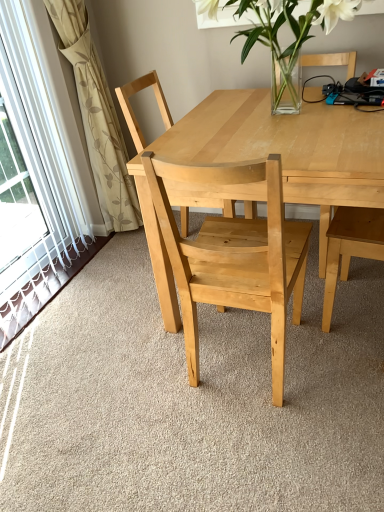
Question: In which direction should I rotate to look at natural wood chair at center, which is counted as the second chair, starting from the front?

Choices:
 (A) left
 (B) right

Answer: (B)

Question: From a real-world perspective, is natural wood chair at center, placed as the first chair when sorted from back to front, physically above beige floral fabric at left?

Choices:
 (A) yes
 (B) no

Answer: (B)

Question: Is beige floral fabric at left at the back of natural wood chair at center, which is counted as the second chair, starting from the front?

Choices:
 (A) no
 (B) yes

Answer: (B)

Question: Can we say natural wood chair at center, which is counted as the second chair, starting from the front, lies outside beige floral fabric at left?

Choices:
 (A) yes
 (B) no

Answer: (A)

Question: From a real-world perspective, is natural wood chair at center, which is counted as the second chair, starting from the front, under beige floral fabric at left?

Choices:
 (A) yes
 (B) no

Answer: (A)

Question: Could you tell me if natural wood chair at center, placed as the first chair when sorted from back to front, is turned towards beige floral fabric at left?

Choices:
 (A) no
 (B) yes

Answer: (A)

Question: Considering the relative sizes of natural wood chair at center, which is counted as the second chair, starting from the front, and beige floral fabric at left in the image provided, is natural wood chair at center, which is counted as the second chair, starting from the front, smaller than beige floral fabric at left?

Choices:
 (A) no
 (B) yes

Answer: (A)

Question: Is natural wood chair at center, marked as the second chair in a back-to-front arrangement, to the left of clear glass vase at upper center from the viewer's perspective?

Choices:
 (A) yes
 (B) no

Answer: (A)

Question: Is natural wood chair at center, the 1th chair viewed from the front, shorter than clear glass vase at upper center?

Choices:
 (A) yes
 (B) no

Answer: (B)

Question: From the image's perspective, does natural wood chair at center, marked as the second chair in a back-to-front arrangement, appear higher than clear glass vase at upper center?

Choices:
 (A) yes
 (B) no

Answer: (B)

Question: Is clear glass vase at upper center inside natural wood chair at center, marked as the second chair in a back-to-front arrangement?

Choices:
 (A) yes
 (B) no

Answer: (B)

Question: Considering the relative sizes of natural wood chair at center, the 1th chair viewed from the front, and clear glass vase at upper center in the image provided, is natural wood chair at center, the 1th chair viewed from the front, taller than clear glass vase at upper center?

Choices:
 (A) no
 (B) yes

Answer: (B)

Question: Is the depth of natural wood chair at center, marked as the second chair in a back-to-front arrangement, greater than that of clear glass vase at upper center?

Choices:
 (A) no
 (B) yes

Answer: (A)

Question: Does natural wood table at center appear on the right side of beige floral fabric at left?

Choices:
 (A) yes
 (B) no

Answer: (A)